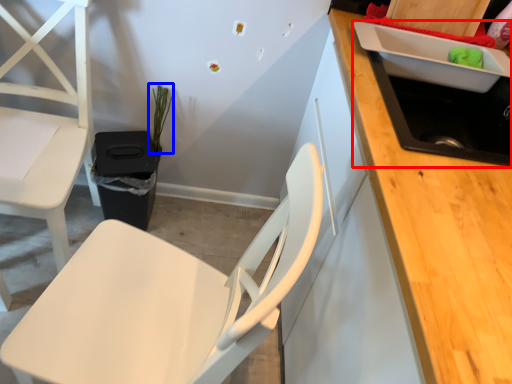
Question: Which point is closer to the camera, sink (highlighted by a red box) or plant (highlighted by a blue box)?

Choices:
 (A) sink
 (B) plant

Answer: (A)